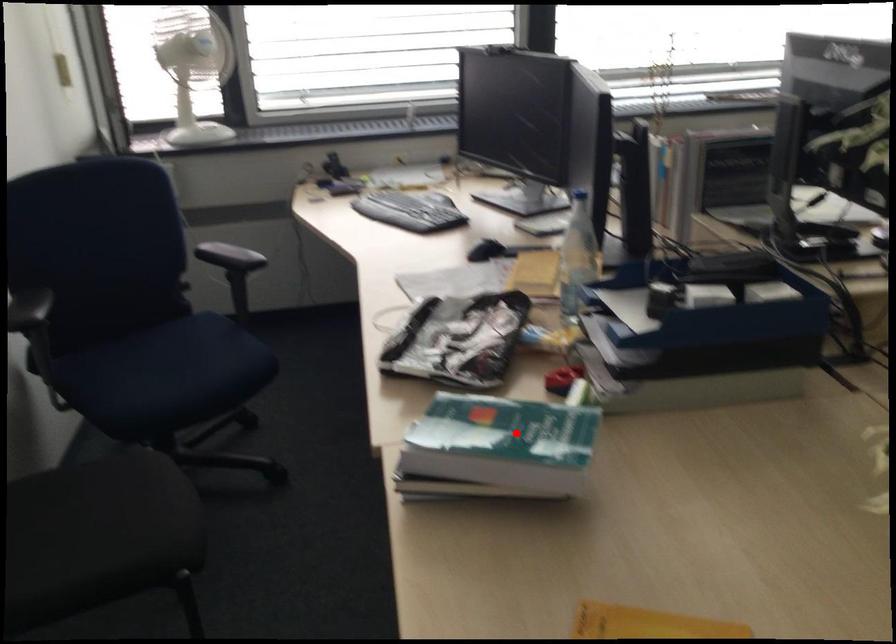
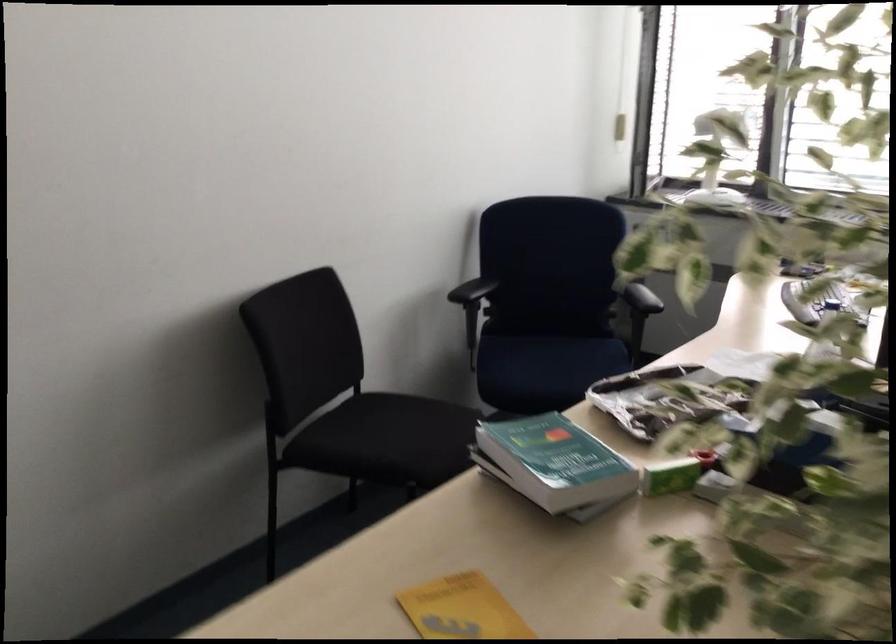
Question: I am providing you with two images of the same scene from different viewpoints. A red point is marked on the first image. Can you still see the location of the red point in image 2?

Choices:
 (A) Yes
 (B) No

Answer: (A)